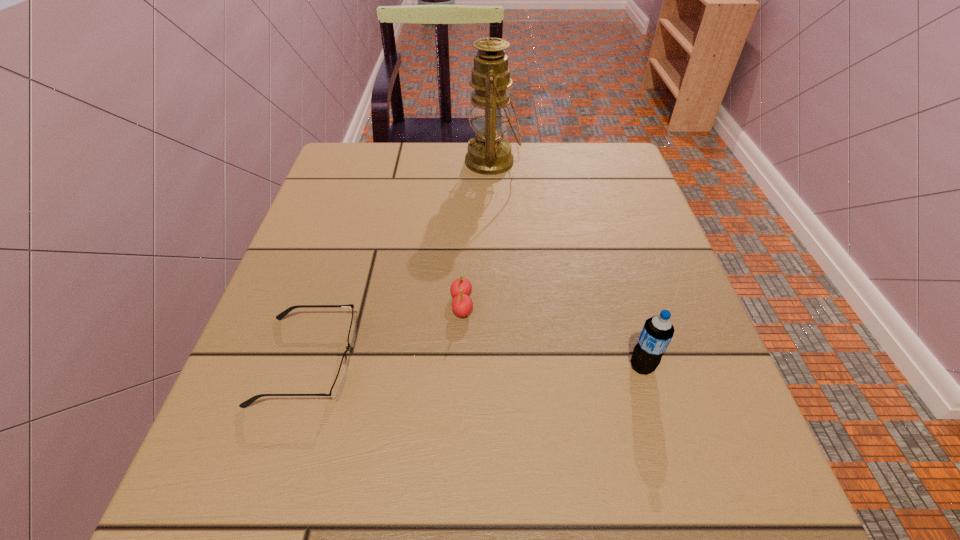
At what (x,y) coordinates should I click in order to perform the action: click on oil lamp. Please return your answer as a coordinate pair (x, y). This screenshot has height=540, width=960. Looking at the image, I should click on (489, 153).

Where is `the tallest object`? This screenshot has width=960, height=540. the tallest object is located at coordinates (489, 153).

This screenshot has height=540, width=960. In order to click on the rightmost object in this screenshot , I will do `click(657, 332)`.

What are the coordinates of `soda bottle` in the screenshot? It's located at (657, 332).

Identify the location of the second shortest object. The image size is (960, 540). (462, 305).

The height and width of the screenshot is (540, 960). I want to click on the shortest object, so click(x=338, y=385).

Identify the location of the leftmost object. The width and height of the screenshot is (960, 540). (338, 385).

Locate an element on the screen. This screenshot has width=960, height=540. vacant space located on the left of the farthest object is located at coordinates (381, 161).

Find the location of a particular element. vacant space located on the front of the second tallest object is located at coordinates (658, 419).

Find the location of `free space located on the left of the second shortest object`. free space located on the left of the second shortest object is located at coordinates (365, 305).